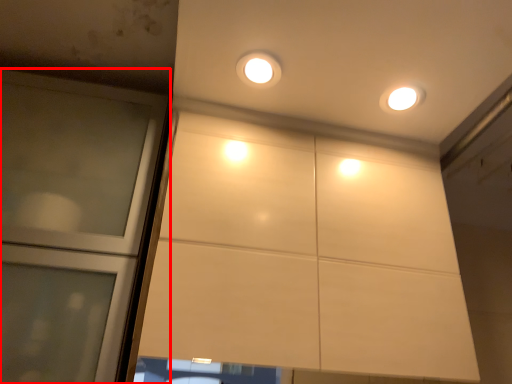
Question: Considering the relative positions of door (annotated by the red box) and dot in the image provided, where is door (annotated by the red box) located with respect to the staircase?

Choices:
 (A) left
 (B) right

Answer: (A)